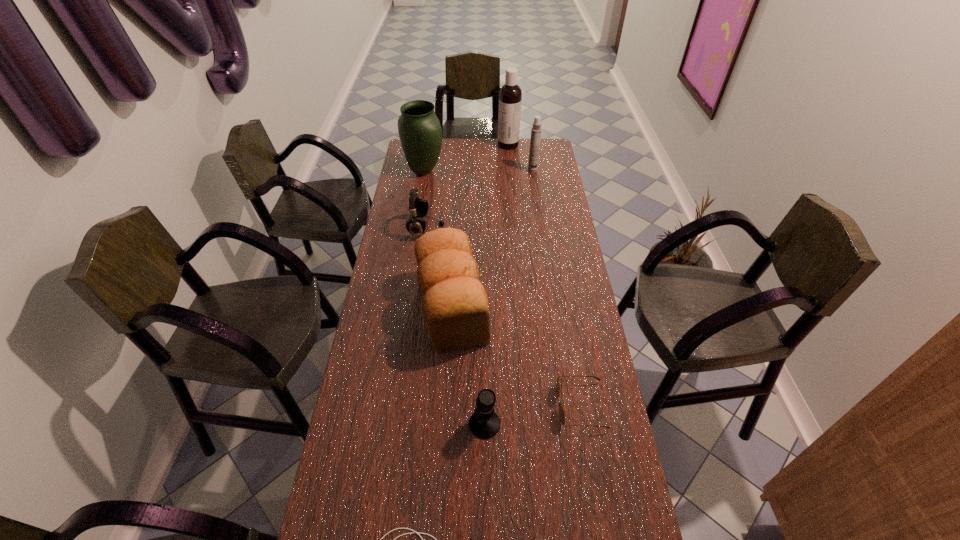
Where is `free region located on the label side of the dishwasher detergent`? This screenshot has width=960, height=540. free region located on the label side of the dishwasher detergent is located at coordinates (482, 145).

Identify the location of vacant space situated on the front of the vase. (414, 236).

The height and width of the screenshot is (540, 960). I want to click on vacant space located 0.220m on the front of the aerosol can, so click(x=537, y=200).

Image resolution: width=960 pixels, height=540 pixels. What are the coordinates of `vacant region located 0.250m on the right of the bread` in the screenshot? It's located at point(561,308).

Where is `free spot located 0.280m with the microphone on the side of the fourth farthest object`? The image size is (960, 540). free spot located 0.280m with the microphone on the side of the fourth farthest object is located at coordinates 511,227.

Locate an element on the screen. The width and height of the screenshot is (960, 540). free location located 0.190m on the back of the microphone is located at coordinates (484, 355).

Where is `vacant area situated 0.150m on the lenses of the shortest object`? Image resolution: width=960 pixels, height=540 pixels. vacant area situated 0.150m on the lenses of the shortest object is located at coordinates (505, 406).

The width and height of the screenshot is (960, 540). I want to click on vacant region located 0.380m on the lenses of the shortest object, so click(426, 406).

The height and width of the screenshot is (540, 960). Identify the location of vacant space situated on the lenses of the shortest object. (485, 406).

Find the location of a particular element. dishwasher detergent that is at the far edge is located at coordinates (510, 95).